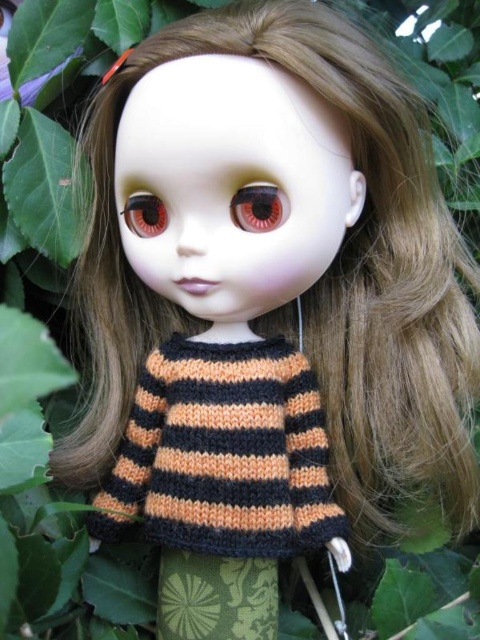
Question: Which of the following is the farthest from the observer?

Choices:
 (A) matte brown eye at center
 (B) green knitted leggings at lower center

Answer: (B)

Question: Estimate the real-world distances between objects in this image. Which object is farther from the matte brown eye at center?

Choices:
 (A) orange knitted sweater at center
 (B) matte plastic eye at center
 (C) green knitted leggings at lower center

Answer: (C)

Question: Which object is closer to the camera taking this photo?

Choices:
 (A) orange knitted sweater at center
 (B) green knitted leggings at lower center
 (C) matte plastic eye at center
 (D) matte brown eye at center

Answer: (D)

Question: Is orange knitted sweater at center positioned before matte brown eye at center?

Choices:
 (A) yes
 (B) no

Answer: (B)

Question: Is orange knitted sweater at center to the left of matte brown eye at center from the viewer's perspective?

Choices:
 (A) yes
 (B) no

Answer: (A)

Question: Is orange knitted sweater at center below green knitted leggings at lower center?

Choices:
 (A) yes
 (B) no

Answer: (B)